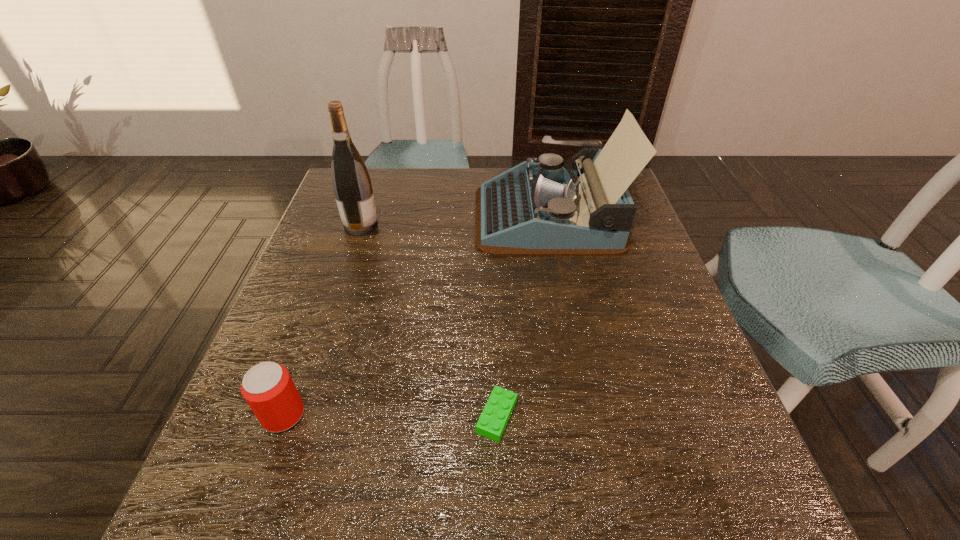
This screenshot has height=540, width=960. In order to click on unoccupied area between the third shortest object and the beer can in this screenshot , I will do `click(416, 315)`.

Locate an element on the screen. The width and height of the screenshot is (960, 540). object that is the closest one to the shortest object is located at coordinates coord(268,388).

Where is `object that is the second closest to the typewriter`? The image size is (960, 540). object that is the second closest to the typewriter is located at coordinates (498, 409).

I want to click on free space that satisfies the following two spatial constraints: 1. on the typing side of the typewriter; 2. on the front side of the third tallest object, so click(x=587, y=415).

In order to click on free space that satisfies the following two spatial constraints: 1. on the typing side of the typewriter; 2. on the front side of the Lego in this screenshot , I will do `click(587, 416)`.

The width and height of the screenshot is (960, 540). In order to click on free space that satisfies the following two spatial constraints: 1. on the label of the tallest object; 2. on the back side of the shortest object in this screenshot , I will do `click(299, 416)`.

The width and height of the screenshot is (960, 540). In order to click on vacant region that satisfies the following two spatial constraints: 1. on the back side of the Lego; 2. on the label of the tallest object in this screenshot , I will do `click(491, 226)`.